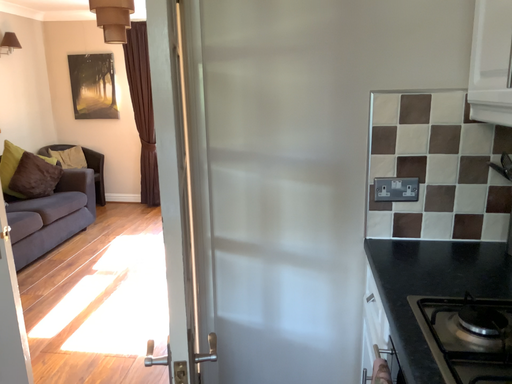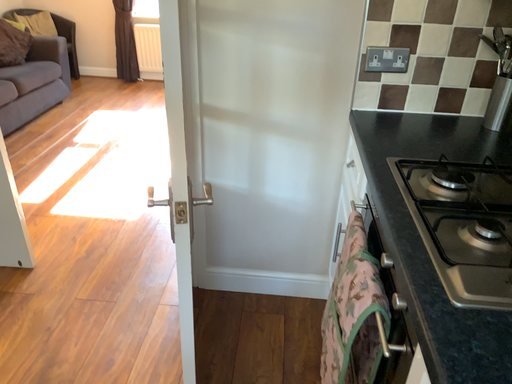
Question: Which way did the camera rotate in the video?

Choices:
 (A) rotated upward
 (B) rotated downward

Answer: (B)